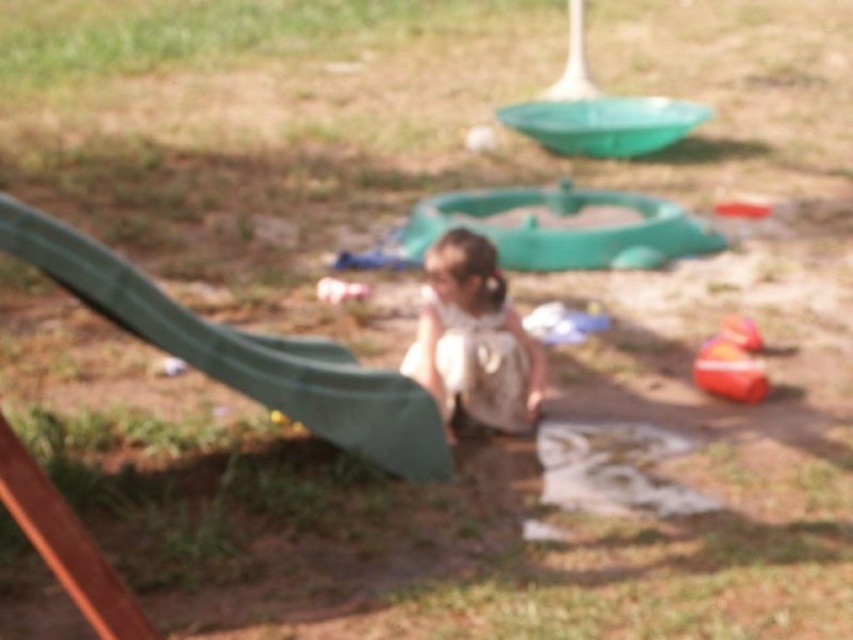
Question: Is green matte slide at left positioned behind white fabric toddler at center?

Choices:
 (A) no
 (B) yes

Answer: (A)

Question: Which object is farther from the camera taking this photo?

Choices:
 (A) white fabric toddler at center
 (B) orange rubber boat at lower right

Answer: (B)

Question: Does green matte slide at left lie in front of orange rubber boat at lower right?

Choices:
 (A) no
 (B) yes

Answer: (B)

Question: Among these points, which one is farthest from the camera?

Choices:
 (A) (415, 426)
 (B) (462, 268)

Answer: (B)

Question: Does green matte slide at left have a greater width compared to white fabric toddler at center?

Choices:
 (A) no
 (B) yes

Answer: (B)

Question: Which object is the closest to the white fabric toddler at center?

Choices:
 (A) orange rubber boat at lower right
 (B) green matte slide at left

Answer: (B)